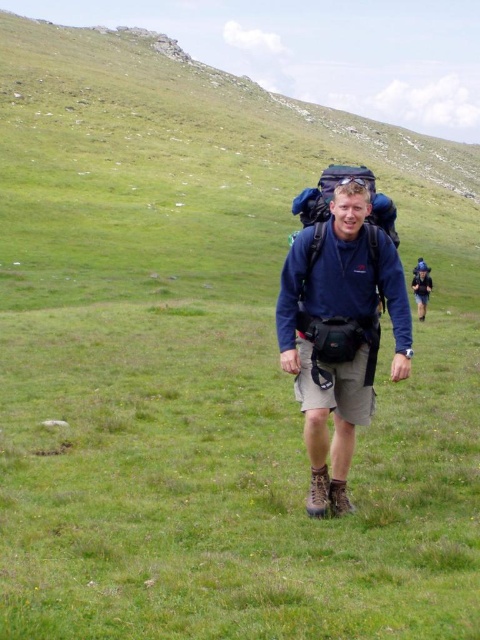
Question: Can you confirm if matte blue shirt at center is positioned above matte blue backpack at center?

Choices:
 (A) yes
 (B) no

Answer: (B)

Question: Can you confirm if matte blue shirt at center is thinner than matte blue backpack at center?

Choices:
 (A) no
 (B) yes

Answer: (A)

Question: In this image, where is matte blue shirt at center located relative to matte blue backpack at center?

Choices:
 (A) above
 (B) below

Answer: (B)

Question: Which point is closer to the camera taking this photo?

Choices:
 (A) (358, 269)
 (B) (421, 268)

Answer: (A)

Question: Which point is closer to the camera?

Choices:
 (A) (351, 230)
 (B) (429, 294)

Answer: (A)

Question: Which object is farther from the camera taking this photo?

Choices:
 (A) matte blue backpack at center
 (B) matte blue shirt at center

Answer: (A)